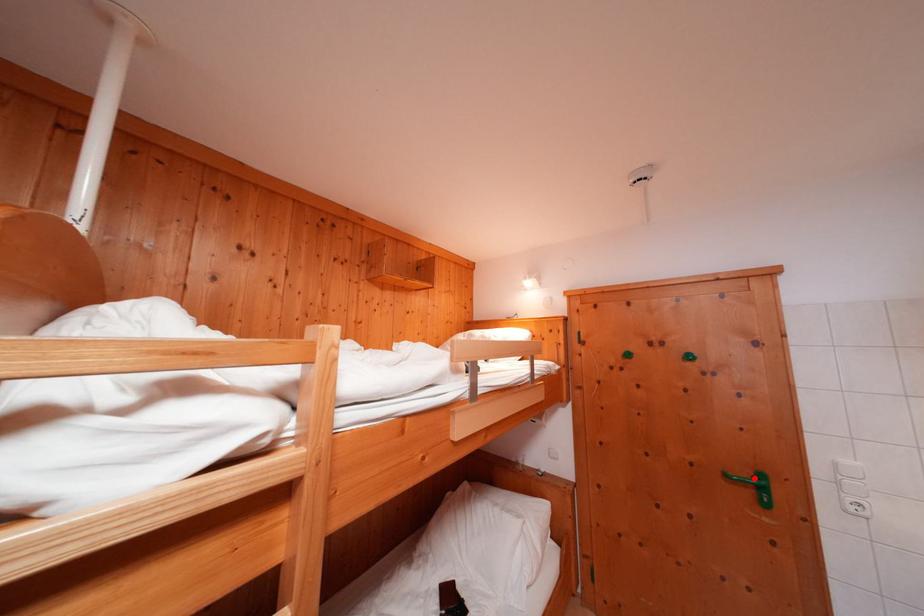
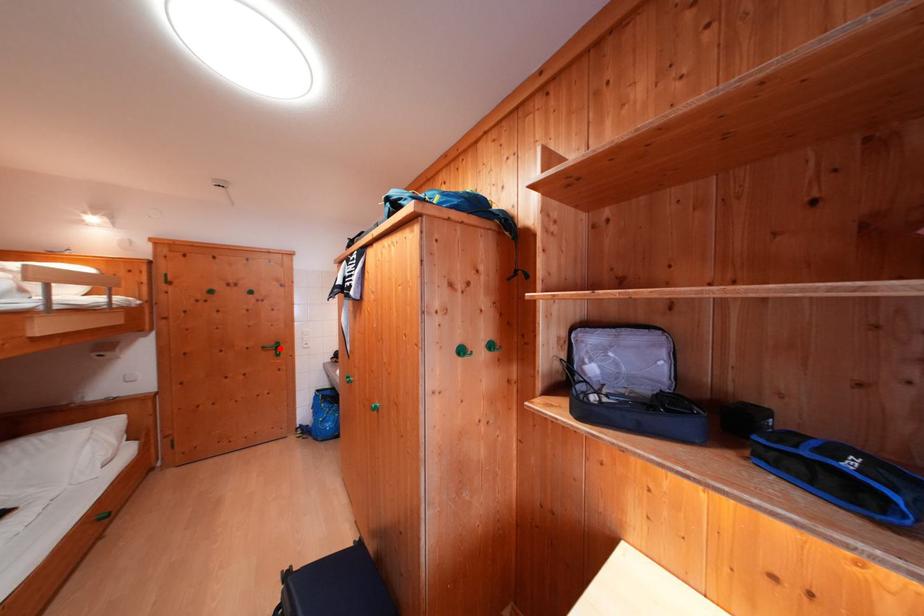
I am providing you with two images of the same scene from different viewpoints. A red point is marked on the first image and another point is marked on the second image. Is the red point in image1 aligned with the point shown in image2?

Yes